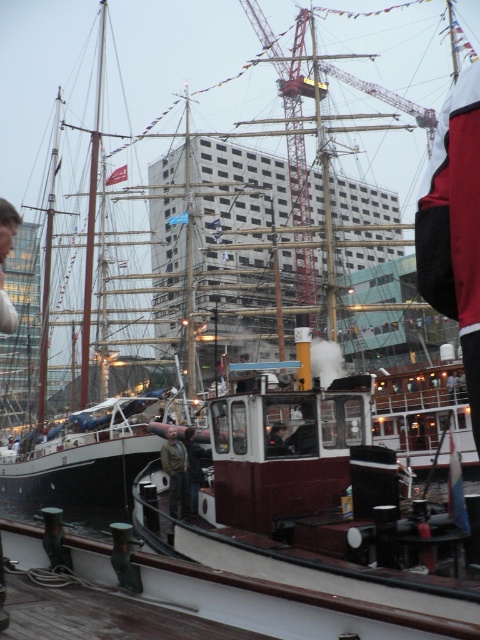
Does dark blue jeans at center appear on the right side of dark brown leather jacket at center?

In fact, dark blue jeans at center is to the left of dark brown leather jacket at center.

Is the position of dark blue jeans at center more distant than that of dark brown leather jacket at center?

Yes, dark blue jeans at center is further from the viewer.

What do you see at coordinates (193, 467) in the screenshot? This screenshot has width=480, height=640. I see `dark blue jeans at center` at bounding box center [193, 467].

The width and height of the screenshot is (480, 640). Find the location of `dark blue jeans at center`. dark blue jeans at center is located at coordinates (193, 467).

Which of these two, brown leather jacket at center or dark blue jeans at center, stands shorter?

Standing shorter between the two is dark blue jeans at center.

Is brown leather jacket at center below dark blue jeans at center?

Yes, brown leather jacket at center is below dark blue jeans at center.

Where is `brown leather jacket at center`? The width and height of the screenshot is (480, 640). brown leather jacket at center is located at coordinates (176, 474).

Is point (167, 456) farther from camera compared to point (276, 445)?

That is True.

Does brown leather jacket at center appear over dark brown leather jacket at center?

No, brown leather jacket at center is not above dark brown leather jacket at center.

Image resolution: width=480 pixels, height=640 pixels. What are the coordinates of `brown leather jacket at center` in the screenshot? It's located at (176, 474).

At what (x,y) coordinates should I click in order to perform the action: click on brown leather jacket at center. Please return your answer as a coordinate pair (x, y). The height and width of the screenshot is (640, 480). Looking at the image, I should click on (176, 474).